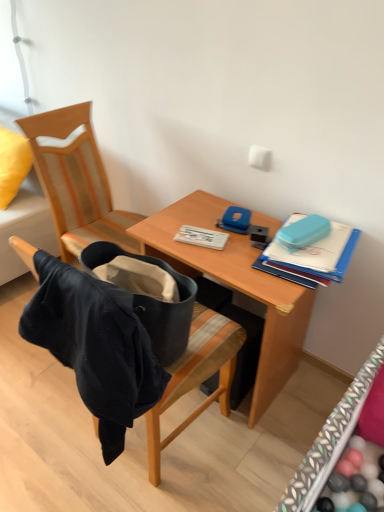
At what (x,y) coordinates should I click in order to perform the action: click on velvet black bag at center, the first chair viewed from the front. Please return your answer as a coordinate pair (x, y). This screenshot has width=384, height=512. Looking at the image, I should click on (196, 376).

The height and width of the screenshot is (512, 384). Find the location of `velvet yellow pillow at upper left`. velvet yellow pillow at upper left is located at coordinates (21, 207).

Describe the element at coordinates (312, 255) in the screenshot. I see `teal plastic case at upper right` at that location.

Image resolution: width=384 pixels, height=512 pixels. Find the location of `velvet black jacket at left, placed as the 1th chair when sorted from back to front`. velvet black jacket at left, placed as the 1th chair when sorted from back to front is located at coordinates (77, 183).

This screenshot has height=512, width=384. What do you see at coordinates (77, 183) in the screenshot?
I see `velvet black jacket at left, placed as the 1th chair when sorted from back to front` at bounding box center [77, 183].

Image resolution: width=384 pixels, height=512 pixels. Identify the location of white plastic notebook at center. (201, 237).

What do you see at coordinates (201, 237) in the screenshot?
I see `white plastic notebook at center` at bounding box center [201, 237].

Locate an element on the screen. Image resolution: width=384 pixels, height=512 pixels. velvet black bag at center, the 2th chair from the back is located at coordinates (196, 376).

From a real-world perspective, is velvet yellow pillow at upper left located beneath teal plastic case at upper right?

Yes.

Between velvet yellow pillow at upper left and teal plastic case at upper right, which one has less height?

teal plastic case at upper right is shorter.

How many degrees apart are the facing directions of velvet yellow pillow at upper left and teal plastic case at upper right?

They differ by 12 degrees in their facing directions.

Where is `book located on the right of velvet yellow pillow at upper left`? This screenshot has width=384, height=512. book located on the right of velvet yellow pillow at upper left is located at coordinates (312, 255).

Is point (201, 242) more distant than point (59, 152)?

No.

Which object is positioned more to the left, white plastic notebook at center or velvet black jacket at left, placed as the 2th chair when sorted from front to back?

Positioned to the left is velvet black jacket at left, placed as the 2th chair when sorted from front to back.

Looking at this image, is velvet black jacket at left, placed as the 2th chair when sorted from front to back, at the back of white plastic notebook at center?

Correct, white plastic notebook at center is looking away from velvet black jacket at left, placed as the 2th chair when sorted from front to back.

From the image's perspective, is white plastic notebook at center on top of velvet black jacket at left, placed as the 1th chair when sorted from back to front?

Incorrect, from the image's perspective, white plastic notebook at center is lower than velvet black jacket at left, placed as the 1th chair when sorted from back to front.

Does white plastic notebook at center have a smaller size compared to teal plastic case at upper right?

Correct, white plastic notebook at center occupies less space than teal plastic case at upper right.

Can you see white plastic notebook at center touching teal plastic case at upper right?

white plastic notebook at center and teal plastic case at upper right are clearly separated.

Considering the positions of objects white plastic notebook at center and teal plastic case at upper right in the image provided, who is in front, white plastic notebook at center or teal plastic case at upper right?

teal plastic case at upper right.

From the image's perspective, is white plastic notebook at center located beneath velvet yellow pillow at upper left?

Indeed, from the image's perspective, white plastic notebook at center is shown beneath velvet yellow pillow at upper left.

Between white plastic notebook at center and velvet yellow pillow at upper left, which one is positioned behind?

velvet yellow pillow at upper left is behind.

Between white plastic notebook at center and velvet yellow pillow at upper left, which one has smaller size?

With smaller size is white plastic notebook at center.

Measure the distance from wooden desk at center to velvet yellow pillow at upper left.

The distance of wooden desk at center from velvet yellow pillow at upper left is 1.03 meters.

Looking at this image, is wooden desk at center next to velvet yellow pillow at upper left and touching it?

wooden desk at center and velvet yellow pillow at upper left are not in contact.

Considering the points (284, 283) and (11, 150), which point is behind, point (284, 283) or point (11, 150)?

The point (11, 150) is more distant.

In the scene shown: From the image's perspective, is wooden desk at center beneath velvet yellow pillow at upper left?

Yes, from the image's perspective, wooden desk at center is beneath velvet yellow pillow at upper left.

Which is correct: white plastic notebook at center is inside wooden desk at center, or outside of it?

white plastic notebook at center is inside wooden desk at center.

Considering the relative sizes of white plastic notebook at center and wooden desk at center in the image provided, is white plastic notebook at center thinner than wooden desk at center?

Yes, white plastic notebook at center is thinner than wooden desk at center.

From the image's perspective, does white plastic notebook at center appear higher than wooden desk at center?

Yes, from the image's perspective, white plastic notebook at center is on top of wooden desk at center.

Is velvet black jacket at left, placed as the 1th chair when sorted from back to front, to the left of teal plastic case at upper right from the viewer's perspective?

Correct, you'll find velvet black jacket at left, placed as the 1th chair when sorted from back to front, to the left of teal plastic case at upper right.

From the image's perspective, is velvet black jacket at left, placed as the 2th chair when sorted from front to back, under teal plastic case at upper right?

Incorrect, from the image's perspective, velvet black jacket at left, placed as the 2th chair when sorted from front to back, is higher than teal plastic case at upper right.

Is velvet black jacket at left, placed as the 2th chair when sorted from front to back, located outside teal plastic case at upper right?

velvet black jacket at left, placed as the 2th chair when sorted from front to back, lies outside teal plastic case at upper right's area.

Is velvet black jacket at left, placed as the 1th chair when sorted from back to front, oriented towards teal plastic case at upper right?

Yes, velvet black jacket at left, placed as the 1th chair when sorted from back to front, faces towards teal plastic case at upper right.

What are the coordinates of `book that is in front of the velvet yellow pillow at upper left` in the screenshot? It's located at (312, 255).

Find the location of a particular element. This screenshot has width=384, height=512. notebook below the velvet black jacket at left, placed as the 2th chair when sorted from front to back (from the image's perspective) is located at coordinates (201, 237).

Considering their positions, is velvet black bag at center, the 2th chair from the back, positioned closer to velvet black jacket at left, placed as the 2th chair when sorted from front to back, than velvet yellow pillow at upper left?

velvet yellow pillow at upper left is closer to velvet black jacket at left, placed as the 2th chair when sorted from front to back.

When comparing their distances from teal plastic case at upper right, does white plastic notebook at center or velvet yellow pillow at upper left seem closer?

The object closer to teal plastic case at upper right is white plastic notebook at center.

From the picture: From the image, which object appears to be nearer to velvet yellow pillow at upper left, teal plastic case at upper right or wooden desk at center?

Based on the image, wooden desk at center appears to be nearer to velvet yellow pillow at upper left.

When comparing their distances from velvet black jacket at left, placed as the 2th chair when sorted from front to back, does wooden desk at center or teal plastic case at upper right seem further?

teal plastic case at upper right is further to velvet black jacket at left, placed as the 2th chair when sorted from front to back.

Estimate the real-world distances between objects in this image. Which object is further from velvet yellow pillow at upper left, teal plastic case at upper right or velvet black bag at center, the first chair viewed from the front?

Among the two, teal plastic case at upper right is located further to velvet yellow pillow at upper left.

From the image, which object appears to be nearer to white plastic notebook at center, teal plastic case at upper right or velvet black bag at center, the first chair viewed from the front?

teal plastic case at upper right is closer to white plastic notebook at center.

Which object lies further to the anchor point velvet yellow pillow at upper left, wooden desk at center or teal plastic case at upper right?

teal plastic case at upper right.

Estimate the real-world distances between objects in this image. Which object is further from velvet yellow pillow at upper left, wooden desk at center or velvet black jacket at left, placed as the 1th chair when sorted from back to front?

Among the two, wooden desk at center is located further to velvet yellow pillow at upper left.

What are the coordinates of `desk between velvet black bag at center, the 2th chair from the back, and white plastic notebook at center in the front-back direction` in the screenshot? It's located at (235, 286).

This screenshot has height=512, width=384. I want to click on desk between velvet yellow pillow at upper left and teal plastic case at upper right in the horizontal direction, so click(235, 286).

I want to click on notebook located between velvet black jacket at left, placed as the 1th chair when sorted from back to front, and wooden desk at center in the left-right direction, so click(201, 237).

The height and width of the screenshot is (512, 384). I want to click on desk between velvet black jacket at left, placed as the 2th chair when sorted from front to back, and teal plastic case at upper right, in the horizontal direction, so click(235, 286).